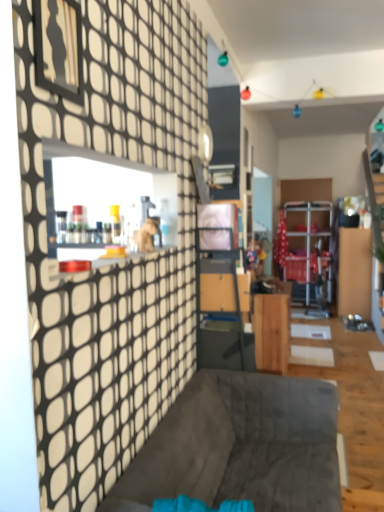
The height and width of the screenshot is (512, 384). Find the location of `dark gray fabric couch at center`. dark gray fabric couch at center is located at coordinates (241, 445).

This screenshot has height=512, width=384. What do you see at coordinates (241, 445) in the screenshot? I see `dark gray fabric couch at center` at bounding box center [241, 445].

What do you see at coordinates (272, 332) in the screenshot? The width and height of the screenshot is (384, 512). I see `wooden cabinet at center` at bounding box center [272, 332].

Where is `wooden cabinet at center`? The height and width of the screenshot is (512, 384). wooden cabinet at center is located at coordinates (272, 332).

Find the location of a particular element. This screenshot has width=384, height=512. dark gray fabric couch at center is located at coordinates (241, 445).

Which object is positioned more to the left, dark gray fabric couch at center or wooden cabinet at center?

dark gray fabric couch at center is more to the left.

In the image, is dark gray fabric couch at center positioned in front of or behind wooden cabinet at center?

Clearly, dark gray fabric couch at center is in front of wooden cabinet at center.

Considering the points (197, 385) and (282, 338), which point is in front, point (197, 385) or point (282, 338)?

Point (197, 385)

From the image's perspective, does dark gray fabric couch at center appear higher than wooden cabinet at center?

No.

Based on the photo, from a real-world perspective, who is located higher, dark gray fabric couch at center or wooden cabinet at center?

wooden cabinet at center.

Which of these two, dark gray fabric couch at center or wooden cabinet at center, is wider?

dark gray fabric couch at center.

Considering the sizes of objects dark gray fabric couch at center and wooden cabinet at center in the image provided, who is taller, dark gray fabric couch at center or wooden cabinet at center?

wooden cabinet at center.

Which of these two, dark gray fabric couch at center or wooden cabinet at center, is smaller?

Smaller between the two is wooden cabinet at center.

Looking at this image, is dark gray fabric couch at center completely or partially outside of wooden cabinet at center?

Yes, dark gray fabric couch at center is located beyond the bounds of wooden cabinet at center.

Are dark gray fabric couch at center and wooden cabinet at center located far from each other?

dark gray fabric couch at center is positioned a significant distance from wooden cabinet at center.

Is wooden cabinet at center at the back of dark gray fabric couch at center?

No, dark gray fabric couch at center is not facing the opposite direction of wooden cabinet at center.

Identify the location of furniture that is in front of the wooden cabinet at center. The width and height of the screenshot is (384, 512). (241, 445).

Consider the image. Between wooden cabinet at center and dark gray fabric couch at center, which one appears on the right side from the viewer's perspective?

wooden cabinet at center.

Is the position of wooden cabinet at center more distant than that of dark gray fabric couch at center?

Yes, it is behind dark gray fabric couch at center.

Which point is more forward, (285, 340) or (115, 498)?

Point (115, 498)

From the image's perspective, who appears lower, wooden cabinet at center or dark gray fabric couch at center?

dark gray fabric couch at center, from the image's perspective.

From a real-world perspective, who is located higher, wooden cabinet at center or dark gray fabric couch at center?

From a 3D spatial view, wooden cabinet at center is above.

Considering the relative sizes of wooden cabinet at center and dark gray fabric couch at center in the image provided, is wooden cabinet at center thinner than dark gray fabric couch at center?

Indeed, wooden cabinet at center has a lesser width compared to dark gray fabric couch at center.

Who is shorter, wooden cabinet at center or dark gray fabric couch at center?

dark gray fabric couch at center is shorter.

Between wooden cabinet at center and dark gray fabric couch at center, which one has larger size?

dark gray fabric couch at center.

Is wooden cabinet at center inside or outside of dark gray fabric couch at center?

wooden cabinet at center is located beyond the bounds of dark gray fabric couch at center.

Is wooden cabinet at center beside dark gray fabric couch at center?

No, wooden cabinet at center is not touching dark gray fabric couch at center.

Does wooden cabinet at center turn towards dark gray fabric couch at center?

No, wooden cabinet at center is not turned towards dark gray fabric couch at center.

How far apart are wooden cabinet at center and dark gray fabric couch at center?

1.34 meters.

Find the location of `furniture on the left of wooden cabinet at center`. furniture on the left of wooden cabinet at center is located at coordinates (241, 445).

This screenshot has height=512, width=384. In order to click on table located above the dark gray fabric couch at center (from the image's perspective) in this screenshot , I will do `click(272, 332)`.

Find the location of a particular element. This screenshot has width=384, height=512. table on the right of dark gray fabric couch at center is located at coordinates (272, 332).